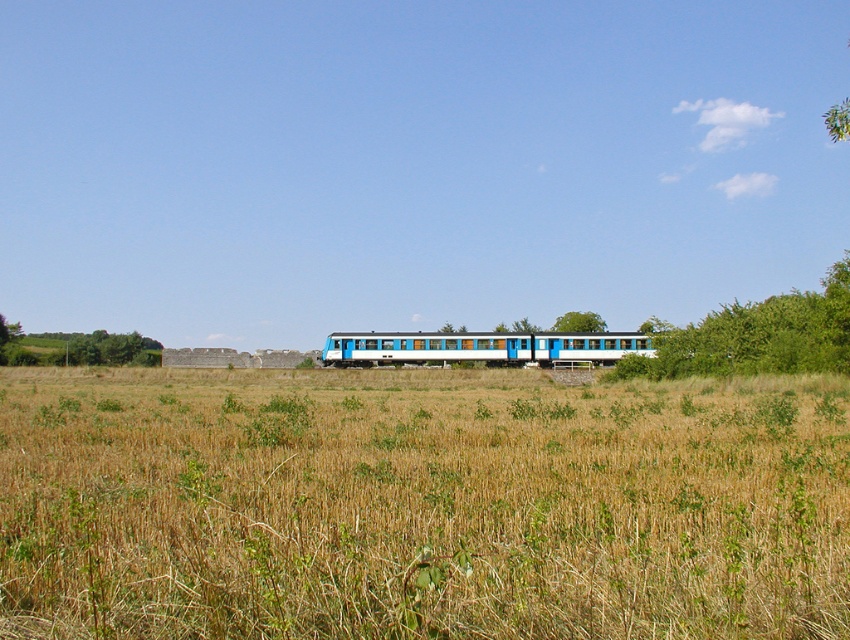
Does white glossy train at center appear on the right side of green leafy tree at left?

Correct, you'll find white glossy train at center to the right of green leafy tree at left.

Who is more forward, (576, 364) or (17, 339)?

Point (576, 364)

You are a GUI agent. You are given a task and a screenshot of the screen. Output one action in this format:
    pyautogui.click(x=<x>, y=<y>)
    Task: Click on the white glossy train at center
    
    Given the screenshot: What is the action you would take?
    pyautogui.click(x=482, y=348)

Can you confirm if green leafy tree at right is bigger than green leafy tree at left?

Correct, green leafy tree at right is larger in size than green leafy tree at left.

Does green leafy tree at right have a smaller size compared to green leafy tree at left?

No, green leafy tree at right is not smaller than green leafy tree at left.

The image size is (850, 640). What do you see at coordinates (758, 336) in the screenshot? I see `green leafy tree at right` at bounding box center [758, 336].

Where is `green leafy tree at right`? The height and width of the screenshot is (640, 850). green leafy tree at right is located at coordinates (758, 336).

Which is more to the right, white glossy train at center or green leafy tree at center?

green leafy tree at center

How distant is white glossy train at center from green leafy tree at center?

white glossy train at center is 59.00 feet away from green leafy tree at center.

Which is behind, point (460, 352) or point (593, 320)?

The point (593, 320) is behind.

Locate an element on the screen. This screenshot has height=640, width=850. white glossy train at center is located at coordinates (482, 348).